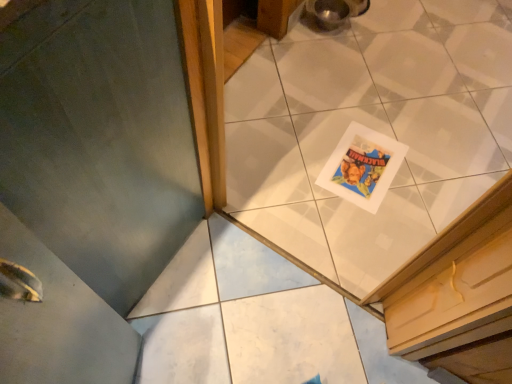
At what (x,y) coordinates should I click in order to perform the action: click on white glossy tile at center. Please return your answer as a coordinate pair (x, y). This screenshot has height=384, width=512. Looking at the image, I should click on (372, 128).

In order to face white glossy tile at center, should I rotate leftwards or rightwards?

Rotate your view right by about 12.089°.

What is the approximate height of white glossy tile at center?

37.09 inches.

The image size is (512, 384). What do you see at coordinates (372, 128) in the screenshot?
I see `white glossy tile at center` at bounding box center [372, 128].

Where is `white glossy tile at center`? white glossy tile at center is located at coordinates (372, 128).